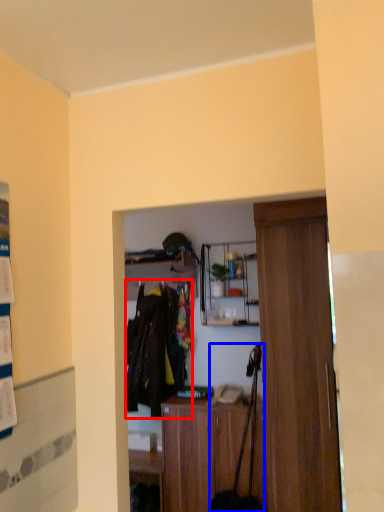
Question: Which object is closer to the camera taking this photo, clothing (highlighted by a red box) or luggage (highlighted by a blue box)?

Choices:
 (A) clothing
 (B) luggage

Answer: (B)